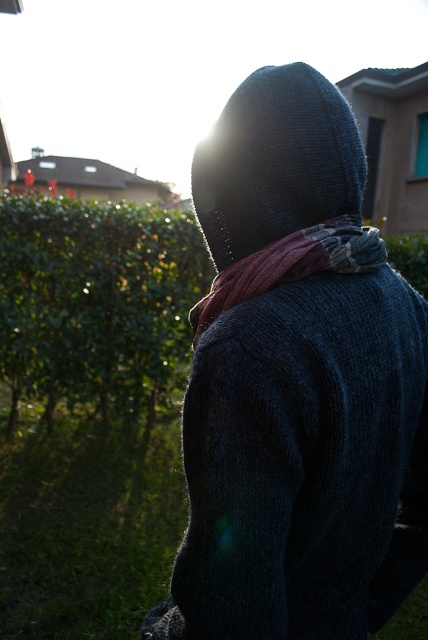
You are a photographer trying to capture the scene. The green leafy hedge at left and the knitted dark blue at back are both in your shot. Which object is positioned to the left of the other?

The green leafy hedge at left is positioned to the left of the knitted dark blue at back.

You are a photographer trying to capture the person in the scene. If you want to focus on the dark knitted hoodie at center without the knitted wool scarf at center appearing in the foreground, should you adjust your camera to focus on a closer or farther subject?

The dark knitted hoodie at center is closer to the viewer than the knitted wool scarf at center. To focus on the hoodie without the scarf in the foreground, adjust the camera to focus on a closer subject so the scarf is blurred in the background.